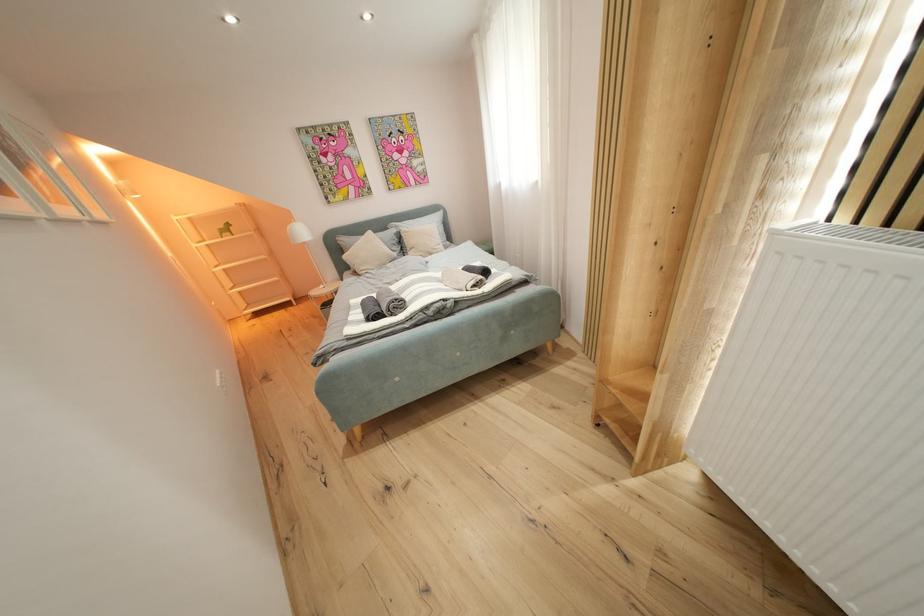
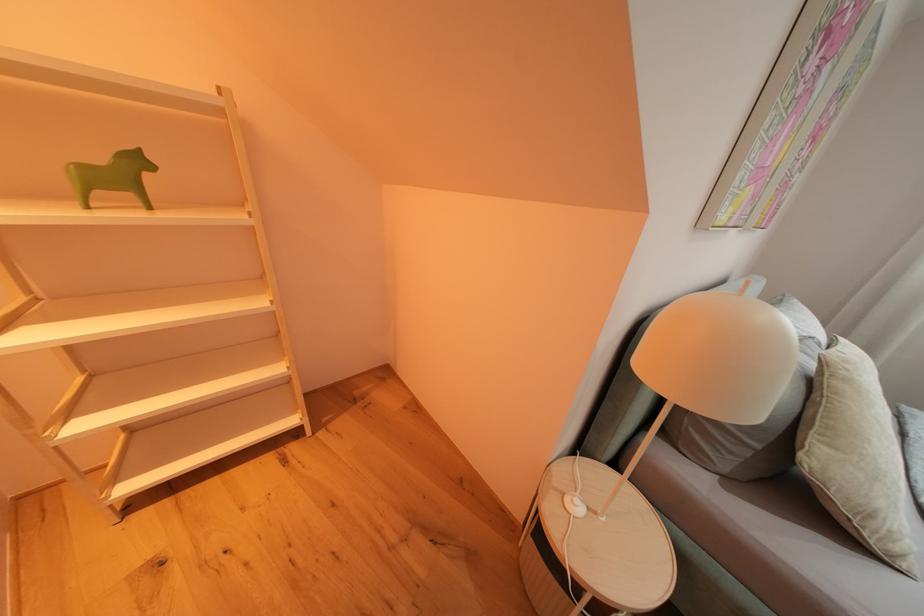
Which direction would the cameraman need to move to produce the second image?

The cameraman walked toward left, forward.